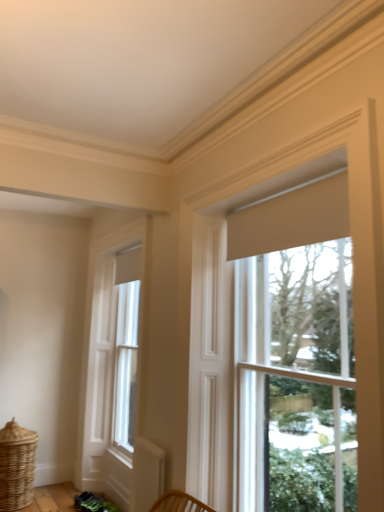
Where is `empty space that is ontop of beige fabric curtain at upper center (from a real-world perspective)`? This screenshot has height=512, width=384. empty space that is ontop of beige fabric curtain at upper center (from a real-world perspective) is located at coordinates (288, 188).